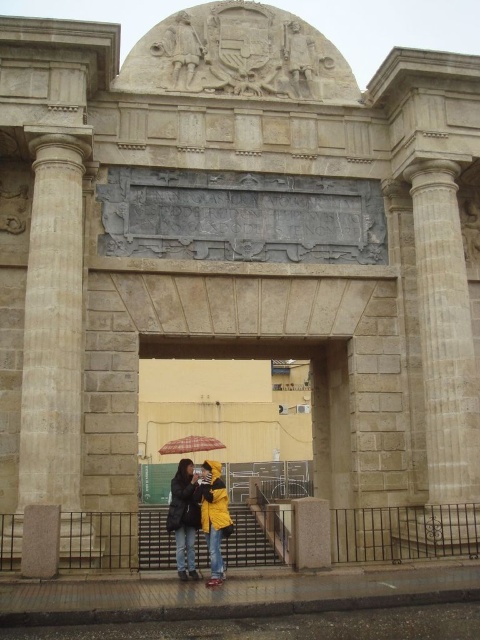
Between yellow matte jacket at center and translucent plastic umbrella at center, which one appears on the left side from the viewer's perspective?

translucent plastic umbrella at center

Who is more forward, (206, 499) or (176, 449)?

Point (206, 499) is more forward.

The height and width of the screenshot is (640, 480). I want to click on yellow matte jacket at center, so click(x=201, y=512).

Is yellow matte umbrella at center behind yellow matte jacket at center?

Yes, it is.

Can you confirm if yellow matte umbrella at center is wider than yellow matte jacket at center?

Yes, yellow matte umbrella at center is wider than yellow matte jacket at center.

Which is in front, point (325, 493) or point (225, 508)?

Point (225, 508) is more forward.

What are the coordinates of `yellow matte umbrella at center` in the screenshot? It's located at (248, 404).

Which of these two, beige stone column at right or yellow matte jacket at center, stands taller?

Standing taller between the two is beige stone column at right.

Who is more distant from viewer, [478,502] or [197,516]?

The point [478,502] is more distant.

Where is `beige stone column at right`? beige stone column at right is located at coordinates (444, 358).